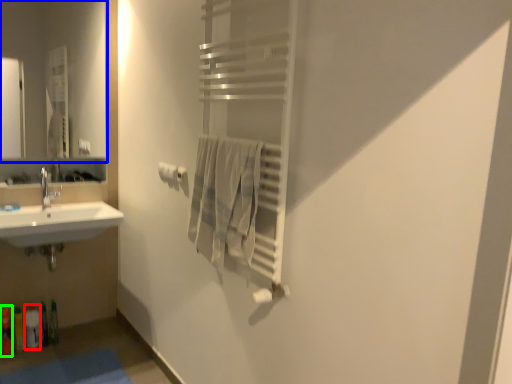
Question: Which object is positioned farthest from toiletry (highlighted by a red box)? Select from mirror (highlighted by a blue box) and toiletry (highlighted by a green box).

Choices:
 (A) mirror
 (B) toiletry

Answer: (A)